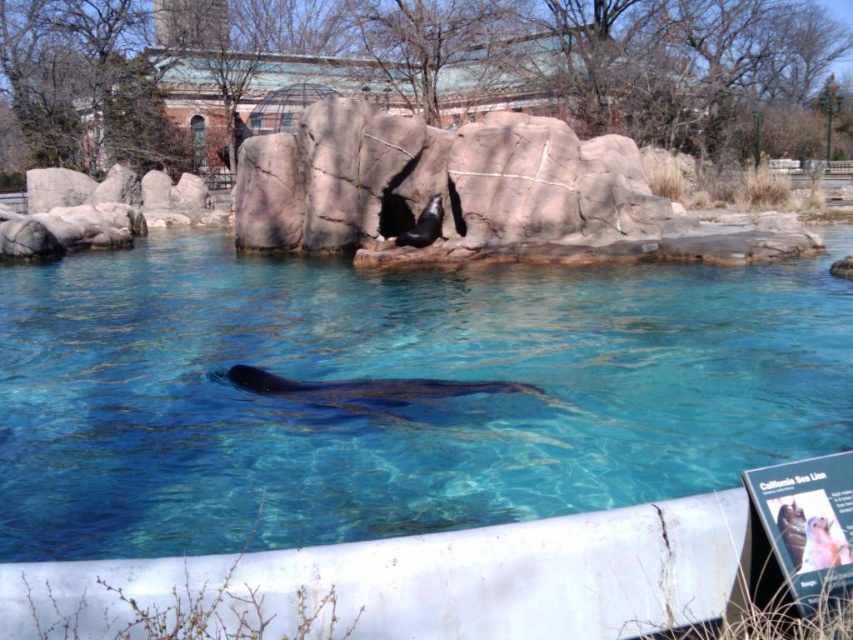
Question: Which is farther from the rough stone rock at center?

Choices:
 (A) clear blue water at center
 (B) black fur seal at center

Answer: (A)

Question: Does rough stone rock at center appear under black fur seal at center?

Choices:
 (A) yes
 (B) no

Answer: (B)

Question: Is clear blue water at center bigger than black smooth whale at center?

Choices:
 (A) yes
 (B) no

Answer: (A)

Question: Which point is closer to the camera?

Choices:
 (A) rough stone rock at center
 (B) black smooth whale at center
 (C) black fur seal at center

Answer: (B)

Question: Can you confirm if clear blue water at center is positioned to the right of black smooth whale at center?

Choices:
 (A) yes
 (B) no

Answer: (A)

Question: Which object appears closest to the camera in this image?

Choices:
 (A) rough stone rock at center
 (B) black smooth whale at center

Answer: (B)